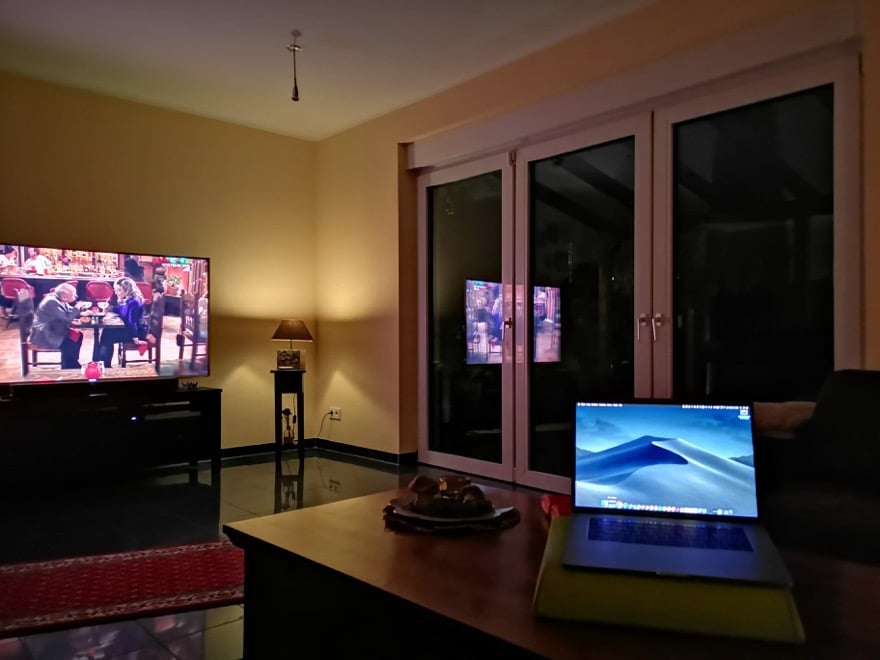
The width and height of the screenshot is (880, 660). I want to click on window, so click(761, 121).